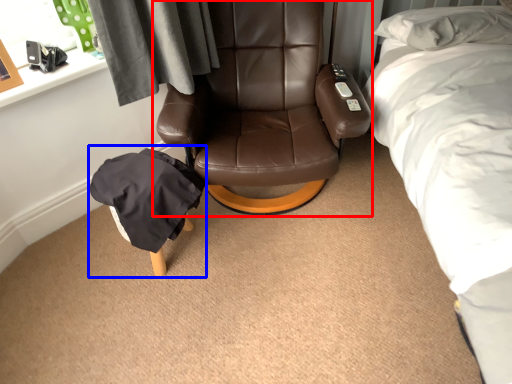
Question: Among these objects, which one is nearest to the camera, chair (highlighted by a red box) or bean bag chair (highlighted by a blue box)?

Choices:
 (A) chair
 (B) bean bag chair

Answer: (A)